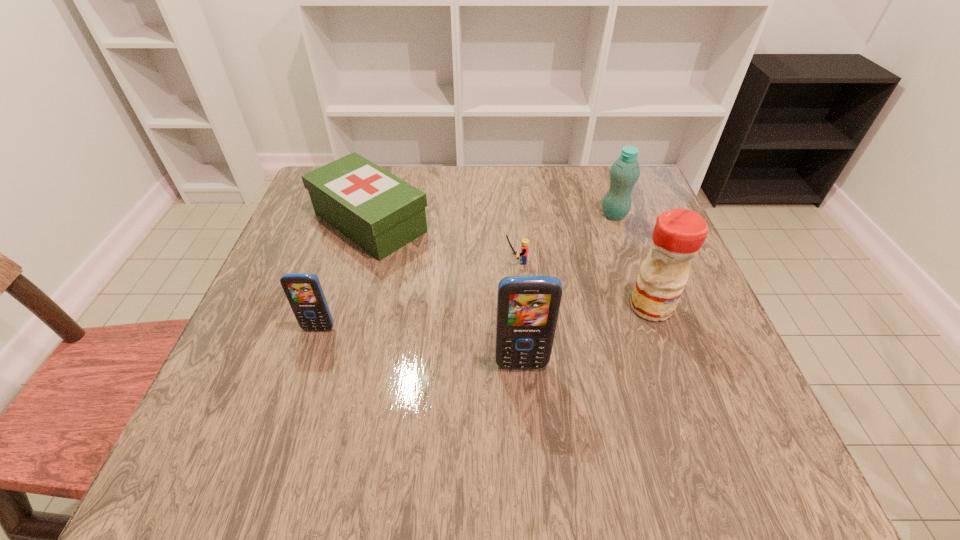
You are a GUI agent. You are given a task and a screenshot of the screen. Output one action in this format:
    pyautogui.click(x=<x>, y=<y>)
    Task: Click on the vacant space at the near left corner of the desktop
    This screenshot has width=960, height=540.
    Given the screenshot: What is the action you would take?
    pyautogui.click(x=248, y=379)

I want to click on vacant space at the near right corner of the desktop, so point(706,405).

In order to click on vacant area that lies between the third nearest object and the Lego in this screenshot , I will do `click(583, 284)`.

The width and height of the screenshot is (960, 540). Identify the location of free space between the third nearest object and the second nearest object. (485, 318).

This screenshot has width=960, height=540. What are the coordinates of `free point between the water bottle and the shortest object` in the screenshot? It's located at (564, 238).

Locate an element on the screen. vacant space that is in between the first-aid kit and the fourth farthest object is located at coordinates (511, 264).

The height and width of the screenshot is (540, 960). Find the location of `free space between the fifth tallest object and the nearer cellular telephone`. free space between the fifth tallest object and the nearer cellular telephone is located at coordinates (445, 293).

The height and width of the screenshot is (540, 960). I want to click on vacant point located between the shortest object and the fourth tallest object, so click(417, 295).

Identify the location of vacant area between the fifth tallest object and the shorter cellular telephone. (345, 275).

You are a GUI agent. You are given a task and a screenshot of the screen. Output one action in this format:
    pyautogui.click(x=<x>, y=<y>)
    Task: Click on the vacant region between the second nearest object and the shortest object
    
    Given the screenshot: What is the action you would take?
    pyautogui.click(x=417, y=295)